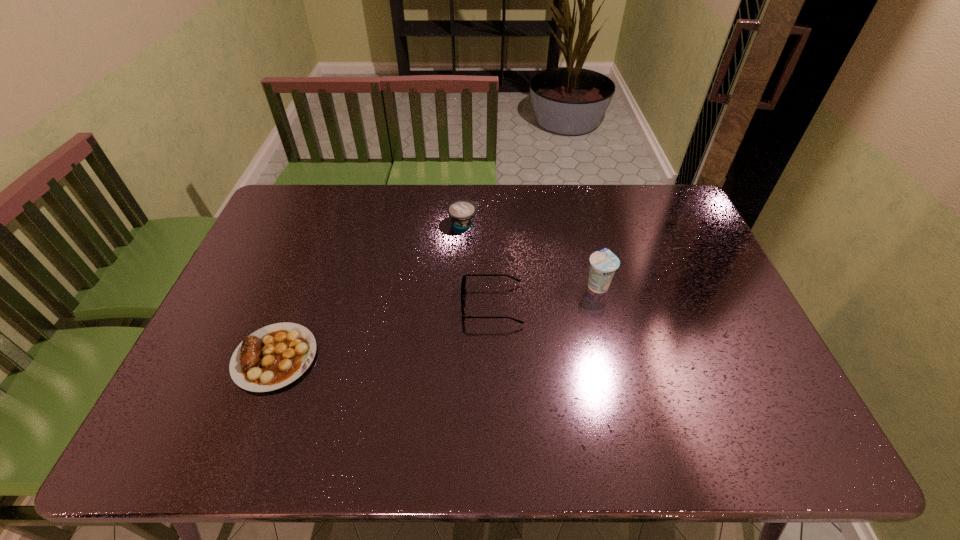
Locate an element on the screen. The height and width of the screenshot is (540, 960). the taller yogurt is located at coordinates (604, 263).

Where is `the right yogurt`? This screenshot has width=960, height=540. the right yogurt is located at coordinates (604, 263).

The height and width of the screenshot is (540, 960). I want to click on the farther yogurt, so click(x=462, y=212).

The width and height of the screenshot is (960, 540). I want to click on the left yogurt, so (462, 212).

You are a GUI agent. You are given a task and a screenshot of the screen. Output one action in this format:
    pyautogui.click(x=<x>, y=<y>)
    Task: Click on the spectacles
    
    Given the screenshot: What is the action you would take?
    pyautogui.click(x=463, y=284)

Image resolution: width=960 pixels, height=540 pixels. I want to click on the shortest object, so click(274, 356).

Image resolution: width=960 pixels, height=540 pixels. I want to click on steak, so click(274, 356).

Image resolution: width=960 pixels, height=540 pixels. I want to click on free space located on the left of the right yogurt, so click(563, 285).

The image size is (960, 540). Identify the location of blank space located 0.250m on the right of the left yogurt. (552, 222).

Where is `free spot located on the front-facing side of the spectacles`? free spot located on the front-facing side of the spectacles is located at coordinates (412, 304).